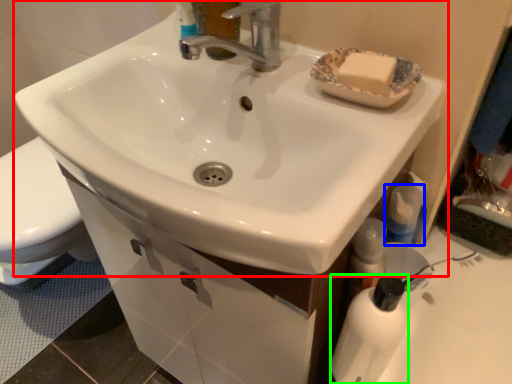
Question: Which object is positioned closest to sink (highlighted by a red box)? Select from mouthwash (highlighted by a blue box) and bottle (highlighted by a green box).

Choices:
 (A) mouthwash
 (B) bottle

Answer: (B)